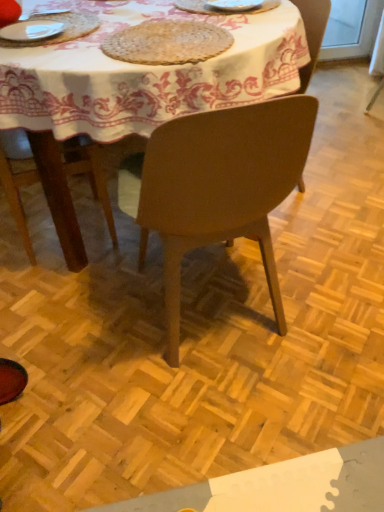
What are the coordinates of `free space in front of matte brown chair at center, marked as the first chair in a front-to-back arrangement` in the screenshot? It's located at (215, 420).